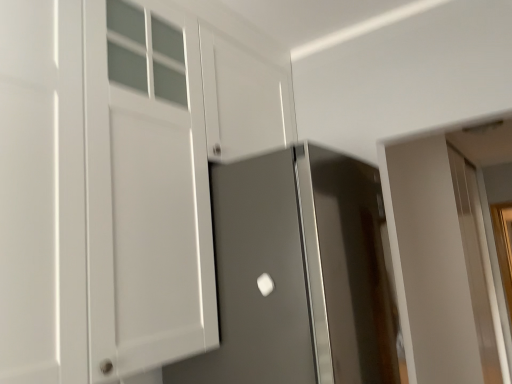
Question: Looking at their shapes, would you say white glossy door handle at center is wider or thinner than white glossy door at right, the 1th door positioned from the right?

Choices:
 (A) thin
 (B) wide

Answer: (A)

Question: Which is correct: white glossy door handle at center is inside white glossy door at right, the 1th door positioned from the back, or outside of it?

Choices:
 (A) outside
 (B) inside

Answer: (A)

Question: Based on their relative distances, which object is farther from the satin gray door at center, the second door from the right?

Choices:
 (A) white matte cabinet at left
 (B) white glossy door handle at center
 (C) white glossy door at right, the 1th door positioned from the right

Answer: (C)

Question: Considering the real-world distances, which object is farthest from the white glossy door at right, the 1th door positioned from the right?

Choices:
 (A) white glossy door handle at center
 (B) white matte cabinet at left
 (C) satin gray door at center, which is the 1th door from left to right

Answer: (B)